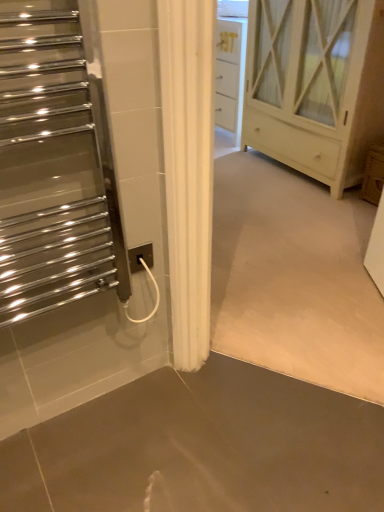
Question: Is white wood cabinet at center smaller than white plastic electric outlet at center?

Choices:
 (A) no
 (B) yes

Answer: (A)

Question: Is white wood cabinet at center bigger than white plastic electric outlet at center?

Choices:
 (A) no
 (B) yes

Answer: (B)

Question: Is white wood cabinet at center shorter than white plastic electric outlet at center?

Choices:
 (A) yes
 (B) no

Answer: (B)

Question: Is white wood cabinet at center to the left of white plastic electric outlet at center from the viewer's perspective?

Choices:
 (A) yes
 (B) no

Answer: (B)

Question: Is white wood cabinet at center to the right of white plastic electric outlet at center from the viewer's perspective?

Choices:
 (A) no
 (B) yes

Answer: (B)

Question: Which is correct: smooth concrete floor at lower center is inside polished chrome towel warmer at left, or outside of it?

Choices:
 (A) outside
 (B) inside

Answer: (A)

Question: From the image's perspective, is smooth concrete floor at lower center located above or below polished chrome towel warmer at left?

Choices:
 (A) below
 (B) above

Answer: (A)

Question: Is smooth concrete floor at lower center to the left or to the right of polished chrome towel warmer at left in the image?

Choices:
 (A) left
 (B) right

Answer: (B)

Question: Considering the positions of point (306, 396) and point (36, 134), is point (306, 396) closer or farther from the camera than point (36, 134)?

Choices:
 (A) farther
 (B) closer

Answer: (A)

Question: From the image's perspective, is white wood cabinet at center positioned above or below white plastic electric outlet at center?

Choices:
 (A) below
 (B) above

Answer: (B)

Question: Based on their positions, is white wood cabinet at center located to the left or right of white plastic electric outlet at center?

Choices:
 (A) right
 (B) left

Answer: (A)

Question: From a real-world perspective, is white wood cabinet at center physically located above or below white plastic electric outlet at center?

Choices:
 (A) above
 (B) below

Answer: (A)

Question: Considering the positions of point (256, 125) and point (142, 266), is point (256, 125) closer or farther from the camera than point (142, 266)?

Choices:
 (A) closer
 (B) farther

Answer: (B)

Question: From the image's perspective, relative to white wood cabinet at center, is polished chrome towel warmer at left above or below?

Choices:
 (A) below
 (B) above

Answer: (A)

Question: Based on their positions, is polished chrome towel warmer at left located to the left or right of white wood cabinet at center?

Choices:
 (A) left
 (B) right

Answer: (A)